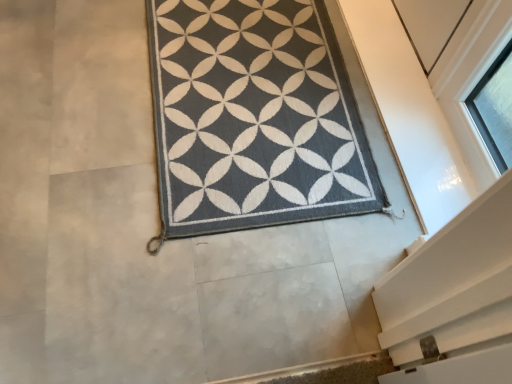
This screenshot has width=512, height=384. Identify the location of vacant area situated below dark gray textured rug at center (from a real-world perspective). (250, 90).